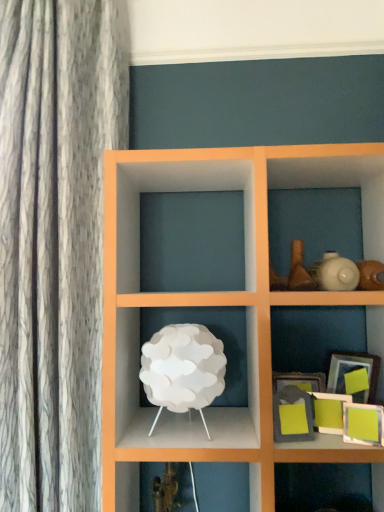
Question: From the image's perspective, would you say matte green picture frame at lower right, placed as the 4th picture frame when sorted from front to back, is shown under matte gray picture frame at lower right, placed as the 2th picture frame when sorted from front to back?

Choices:
 (A) no
 (B) yes

Answer: (A)

Question: Does matte green picture frame at lower right, placed as the 4th picture frame when sorted from front to back, appear on the right side of matte gray picture frame at lower right, placed as the 2th picture frame when sorted from front to back?

Choices:
 (A) no
 (B) yes

Answer: (B)

Question: From the image's perspective, is matte green picture frame at lower right, marked as the second picture frame in a back-to-front arrangement, on matte gray picture frame at lower right, placed as the 2th picture frame when sorted from front to back?

Choices:
 (A) no
 (B) yes

Answer: (B)

Question: Does matte green picture frame at lower right, placed as the 4th picture frame when sorted from front to back, touch matte gray picture frame at lower right, which is the fourth picture frame from back to front?

Choices:
 (A) no
 (B) yes

Answer: (A)

Question: From a real-world perspective, is matte green picture frame at lower right, marked as the second picture frame in a back-to-front arrangement, located higher than matte gray picture frame at lower right, placed as the 2th picture frame when sorted from front to back?

Choices:
 (A) no
 (B) yes

Answer: (B)

Question: Does matte green picture frame at lower right, placed as the 4th picture frame when sorted from front to back, contain matte gray picture frame at lower right, which is the fourth picture frame from back to front?

Choices:
 (A) no
 (B) yes

Answer: (A)

Question: Considering the relative sizes of matte green picture frame at lower right, the 1th picture frame in the front-to-back sequence, and matte gray picture frame at lower right, which is the fourth picture frame from back to front, in the image provided, is matte green picture frame at lower right, the 1th picture frame in the front-to-back sequence, smaller than matte gray picture frame at lower right, which is the fourth picture frame from back to front,?

Choices:
 (A) no
 (B) yes

Answer: (B)

Question: Can you confirm if matte green picture frame at lower right, placed as the fifth picture frame when sorted from back to front, is thinner than matte gray picture frame at lower right, which is the fourth picture frame from back to front?

Choices:
 (A) yes
 (B) no

Answer: (A)

Question: Can you confirm if matte green picture frame at lower right, the 1th picture frame in the front-to-back sequence, is positioned to the left of matte gray picture frame at lower right, which is the fourth picture frame from back to front?

Choices:
 (A) yes
 (B) no

Answer: (B)

Question: Is matte green picture frame at lower right, placed as the fifth picture frame when sorted from back to front, next to matte gray picture frame at lower right, placed as the 2th picture frame when sorted from front to back?

Choices:
 (A) no
 (B) yes

Answer: (A)

Question: Considering the relative sizes of matte green picture frame at lower right, placed as the fifth picture frame when sorted from back to front, and matte gray picture frame at lower right, which is the fourth picture frame from back to front, in the image provided, is matte green picture frame at lower right, placed as the fifth picture frame when sorted from back to front, wider than matte gray picture frame at lower right, which is the fourth picture frame from back to front,?

Choices:
 (A) no
 (B) yes

Answer: (A)

Question: Is matte gray picture frame at lower right, which is the fourth picture frame from back to front, at the back of matte green picture frame at lower right, placed as the fifth picture frame when sorted from back to front?

Choices:
 (A) yes
 (B) no

Answer: (B)

Question: From a real-world perspective, is matte gray picture frame at lower right, which is the fourth picture frame from back to front, beneath matte green picture frame at lower right, the 1th picture frame in the front-to-back sequence?

Choices:
 (A) yes
 (B) no

Answer: (B)